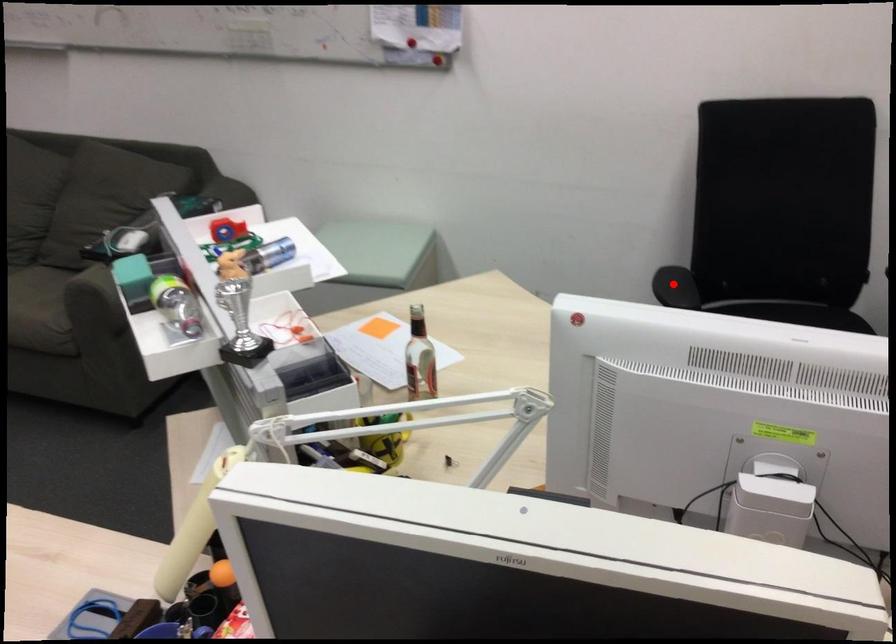
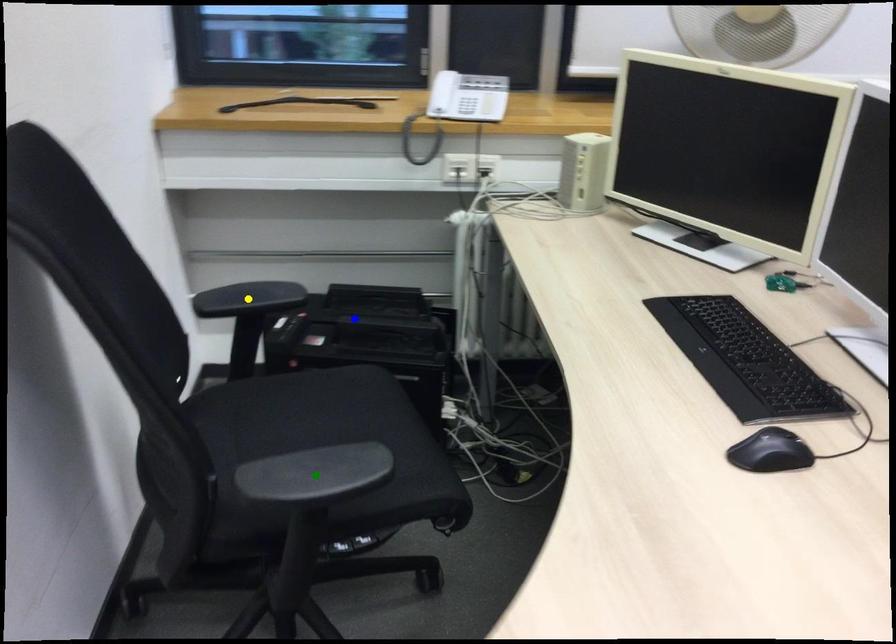
Question: I am providing you with two images of the same scene from different viewpoints. A red point is marked on the first image. You are given multiple points on the second image. Which point in image 2 is actually the same real-world point as the red point in image 1?

Choices:
 (A) blue point
 (B) green point
 (C) yellow point

Answer: (B)